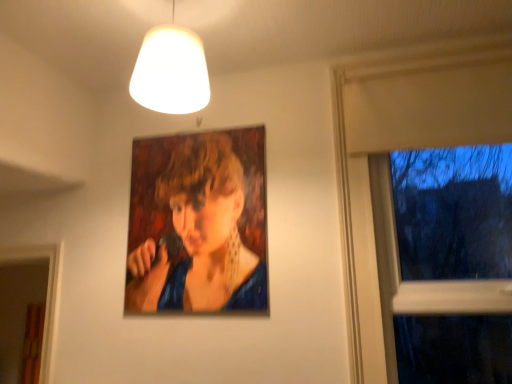
Question: From a real-world perspective, is transparent glass window at right beneath white matte lampshade at upper center?

Choices:
 (A) yes
 (B) no

Answer: (A)

Question: Is transparent glass window at right facing away from white matte lampshade at upper center?

Choices:
 (A) yes
 (B) no

Answer: (B)

Question: From the image's perspective, is transparent glass window at right under white matte lampshade at upper center?

Choices:
 (A) no
 (B) yes

Answer: (B)

Question: Can you confirm if transparent glass window at right is bigger than white matte lampshade at upper center?

Choices:
 (A) no
 (B) yes

Answer: (B)

Question: Does transparent glass window at right have a lesser width compared to white matte lampshade at upper center?

Choices:
 (A) yes
 (B) no

Answer: (A)

Question: From a real-world perspective, is transparent glass window at right located higher than white matte lampshade at upper center?

Choices:
 (A) yes
 (B) no

Answer: (B)

Question: Can you see oil painting portrait at center touching white matte lampshade at upper center?

Choices:
 (A) yes
 (B) no

Answer: (B)

Question: Is oil painting portrait at center taller than white matte lampshade at upper center?

Choices:
 (A) yes
 (B) no

Answer: (A)

Question: Is the depth of oil painting portrait at center greater than that of white matte lampshade at upper center?

Choices:
 (A) no
 (B) yes

Answer: (B)

Question: Is oil painting portrait at center far from white matte lampshade at upper center?

Choices:
 (A) yes
 (B) no

Answer: (B)

Question: From a real-world perspective, is oil painting portrait at center located beneath white matte lampshade at upper center?

Choices:
 (A) no
 (B) yes

Answer: (B)

Question: Is oil painting portrait at center positioned in front of white matte lampshade at upper center?

Choices:
 (A) yes
 (B) no

Answer: (B)

Question: Are white matte lampshade at upper center and oil painting portrait at center located far from each other?

Choices:
 (A) no
 (B) yes

Answer: (A)